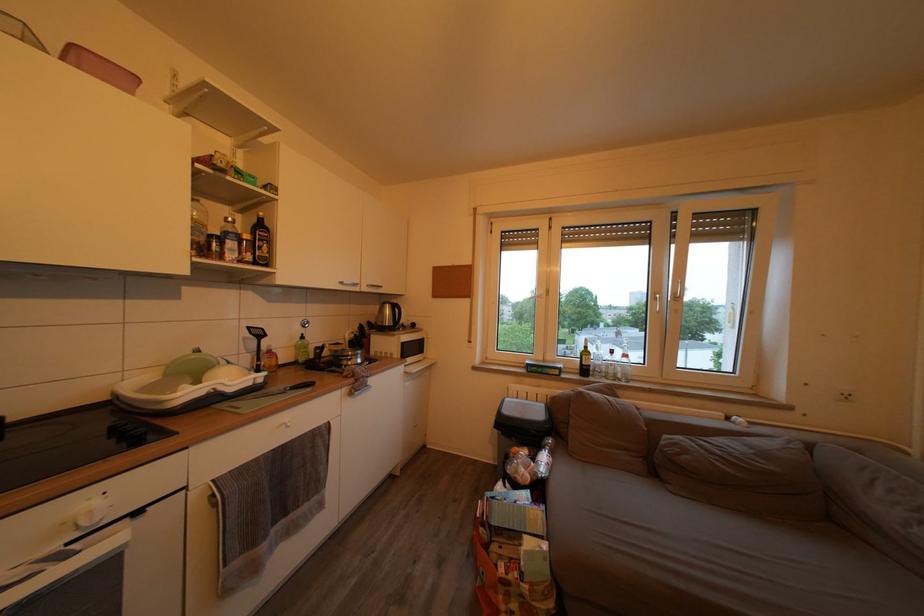
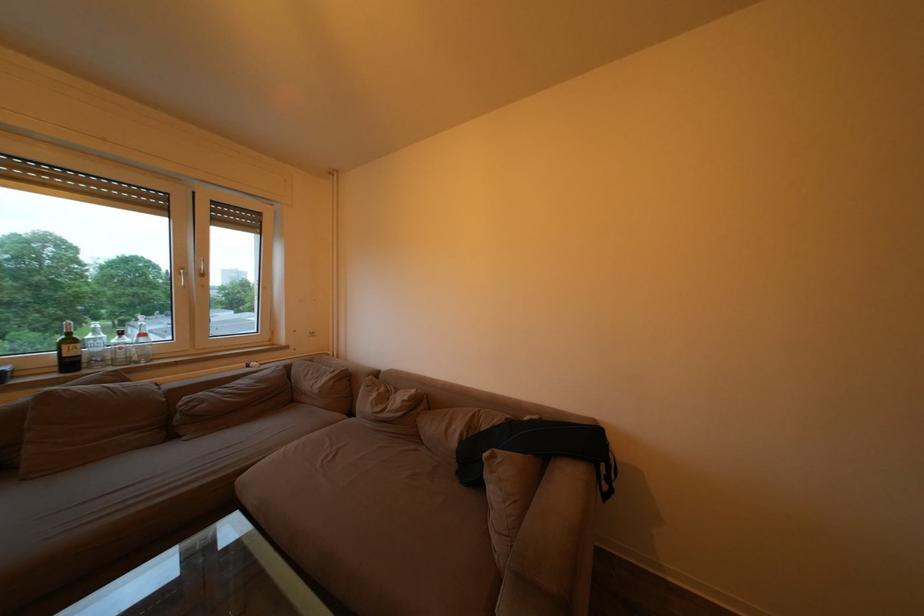
Locate, in the second image, the point that corresponds to [634,362] in the first image.

(151, 341)